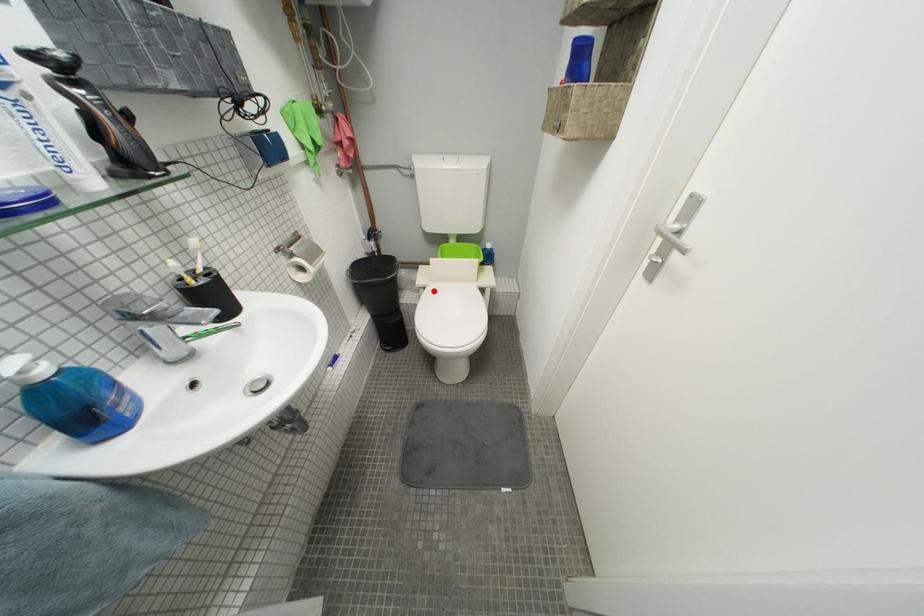
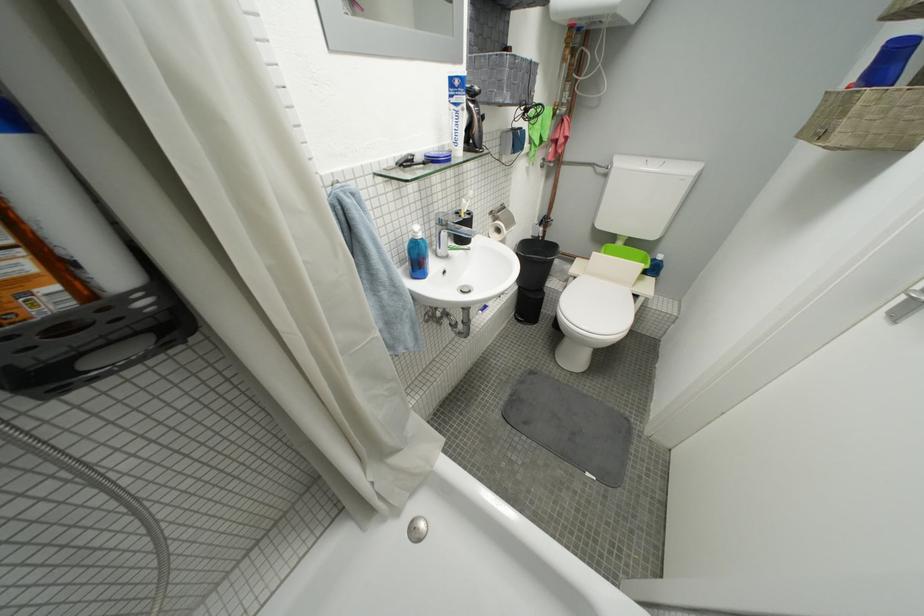
Where in the second image is the point corresponding to the highlighted location from the first image?

(584, 281)